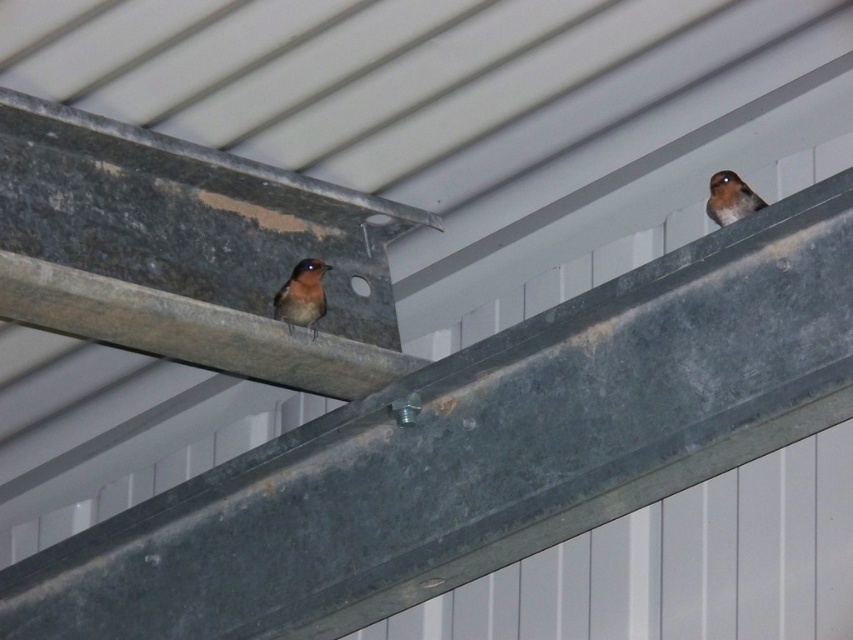
Is brown feathered bird at center taller than brown feathered bird at upper right?

Indeed, brown feathered bird at center has a greater height compared to brown feathered bird at upper right.

Can you confirm if brown feathered bird at center is bigger than brown feathered bird at upper right?

Correct, brown feathered bird at center is larger in size than brown feathered bird at upper right.

Which is in front, point (306, 284) or point (740, 214)?

Positioned in front is point (740, 214).

Locate an element on the screen. This screenshot has height=640, width=853. brown feathered bird at center is located at coordinates (302, 296).